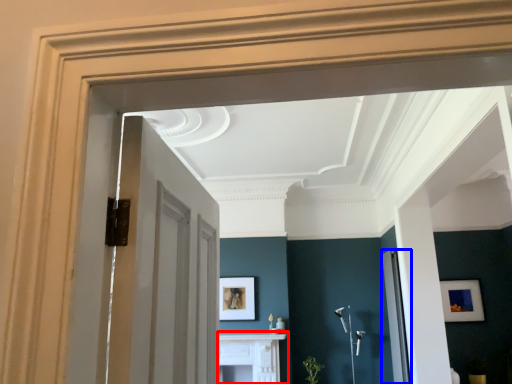
Question: Which object is further to the camera taking this photo, table (highlighted by a red box) or glass door (highlighted by a blue box)?

Choices:
 (A) table
 (B) glass door

Answer: (A)